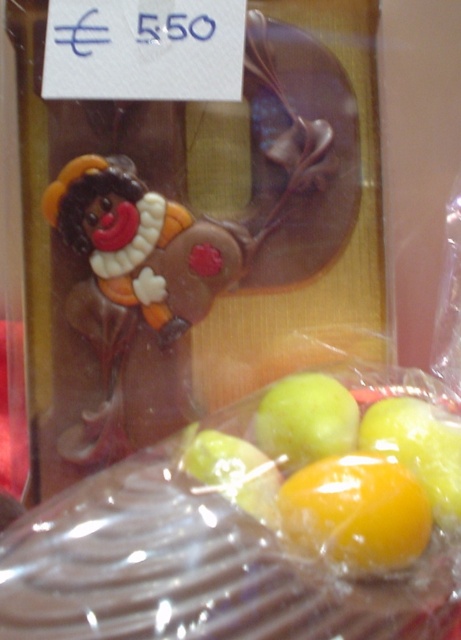
Who is positioned more to the left, yellow shiny fruit at lower center or green matte apple at center?

Positioned to the left is green matte apple at center.

Is yellow shiny fruit at lower center thinner than green matte apple at center?

Incorrect, yellow shiny fruit at lower center's width is not less than green matte apple at center's.

Is point (424, 492) positioned after point (281, 448)?

No, (424, 492) is in front of (281, 448).

Find the location of a particular element. yellow shiny fruit at lower center is located at coordinates (356, 509).